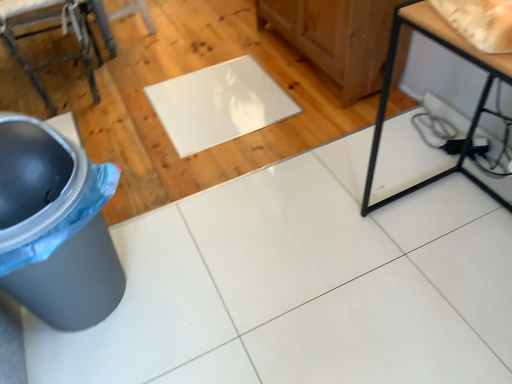
The width and height of the screenshot is (512, 384). I want to click on metallic gray stool at upper left, so click(63, 33).

Where is `glossy white mat at center`? The height and width of the screenshot is (384, 512). glossy white mat at center is located at coordinates (219, 104).

This screenshot has width=512, height=384. Find the location of `gray plastic trash can at lower left`. gray plastic trash can at lower left is located at coordinates (36, 178).

You are a GUI agent. You are given a task and a screenshot of the screen. Output one action in this format:
    pyautogui.click(x=<x>, y=<y>)
    Task: Click on the metallic gray stool at upper left
    The width and height of the screenshot is (512, 384).
    Given the screenshot: What is the action you would take?
    pyautogui.click(x=63, y=33)

Is black metal table at lower right smaller than glossy white mat at center?

No.

From the image's perspective, between black metal table at lower right and glossy white mat at center, who is located below?

From the image's view, black metal table at lower right is below.

Is black metal table at lower right surrounding glossy white mat at center?

Actually, glossy white mat at center is outside black metal table at lower right.

Does black metal table at lower right appear on the left side of glossy white mat at center?

Incorrect, black metal table at lower right is not on the left side of glossy white mat at center.

From a real-world perspective, between metallic gray stool at upper left and gray plastic trash can at lower left, who is vertically lower?

From a 3D spatial view, metallic gray stool at upper left is below.

Would you say metallic gray stool at upper left is a long distance from gray plastic trash can at lower left?

metallic gray stool at upper left is positioned a significant distance from gray plastic trash can at lower left.

Is metallic gray stool at upper left not inside gray plastic trash can at lower left?

Yes.

From the image's perspective, is gray plastic trash can at lower left located beneath black metal table at lower right?

Indeed, from the image's perspective, gray plastic trash can at lower left is shown beneath black metal table at lower right.

Is gray plastic trash can at lower left with black metal table at lower right?

gray plastic trash can at lower left and black metal table at lower right are clearly separated.

Does gray plastic trash can at lower left have a greater height compared to black metal table at lower right?

No.

From a real-world perspective, is black metal table at lower right located higher than metallic gray stool at upper left?

Yes, from a real-world perspective, black metal table at lower right is over metallic gray stool at upper left

Between black metal table at lower right and metallic gray stool at upper left, which one has more height?

black metal table at lower right is taller.

From the image's perspective, which one is positioned lower, black metal table at lower right or metallic gray stool at upper left?

black metal table at lower right is shown below in the image.

Who is smaller, black metal table at lower right or metallic gray stool at upper left?

With smaller size is metallic gray stool at upper left.

Is glossy white mat at center not close to metallic gray stool at upper left?

That's not correct — glossy white mat at center is a little close to metallic gray stool at upper left.

Looking at their sizes, would you say glossy white mat at center is wider or thinner than metallic gray stool at upper left?

Clearly, glossy white mat at center has more width compared to metallic gray stool at upper left.

From the image's perspective, between glossy white mat at center and metallic gray stool at upper left, who is located below?

From the image's view, glossy white mat at center is below.

Can you confirm if glossy white mat at center is bigger than metallic gray stool at upper left?

No, glossy white mat at center is not bigger than metallic gray stool at upper left.

Which of these two, metallic gray stool at upper left or black metal table at lower right, is bigger?

Bigger between the two is black metal table at lower right.

Is metallic gray stool at upper left completely or partially outside of black metal table at lower right?

That's correct, metallic gray stool at upper left is outside of black metal table at lower right.

Could you tell me if metallic gray stool at upper left is turned towards black metal table at lower right?

No, metallic gray stool at upper left is not facing towards black metal table at lower right.

Locate an element on the screen. The width and height of the screenshot is (512, 384). furniture lying on the left of black metal table at lower right is located at coordinates [63, 33].

Looking at this image, is glossy white mat at center wider than gray plastic trash can at lower left?

Indeed, glossy white mat at center has a greater width compared to gray plastic trash can at lower left.

Does point (230, 136) lie in front of point (50, 137)?

No, it is not.

Who is smaller, glossy white mat at center or gray plastic trash can at lower left?

With smaller size is glossy white mat at center.

This screenshot has height=384, width=512. In order to click on mat that is under the black metal table at lower right (from a real-world perspective) in this screenshot , I will do `click(219, 104)`.

The height and width of the screenshot is (384, 512). Identify the location of waste container that is above the metallic gray stool at upper left (from a real-world perspective). (36, 178).

Which object lies nearer to the anchor point black metal table at lower right, metallic gray stool at upper left or glossy white mat at center?

The object closer to black metal table at lower right is glossy white mat at center.

From the image, which object appears to be nearer to metallic gray stool at upper left, gray plastic trash can at lower left or glossy white mat at center?

glossy white mat at center is closer to metallic gray stool at upper left.

From the image, which object appears to be nearer to glossy white mat at center, metallic gray stool at upper left or gray plastic trash can at lower left?

metallic gray stool at upper left is positioned closer to the anchor glossy white mat at center.

When comparing their distances from black metal table at lower right, does glossy white mat at center or metallic gray stool at upper left seem closer?

Among the two, glossy white mat at center is located nearer to black metal table at lower right.

Which object lies further to the anchor point gray plastic trash can at lower left, black metal table at lower right or metallic gray stool at upper left?

metallic gray stool at upper left lies further to gray plastic trash can at lower left than the other object.

Estimate the real-world distances between objects in this image. Which object is further from black metal table at lower right, gray plastic trash can at lower left or glossy white mat at center?

Among the two, gray plastic trash can at lower left is located further to black metal table at lower right.

Looking at the image, which one is located closer to gray plastic trash can at lower left, glossy white mat at center or black metal table at lower right?

The object closer to gray plastic trash can at lower left is glossy white mat at center.

Looking at the image, which one is located closer to glossy white mat at center, gray plastic trash can at lower left or black metal table at lower right?

black metal table at lower right.

Locate an element on the screen. waste container between black metal table at lower right and glossy white mat at center along the z-axis is located at coordinates click(36, 178).

This screenshot has height=384, width=512. I want to click on waste container between metallic gray stool at upper left and black metal table at lower right from left to right, so click(36, 178).

Identify the location of furniture positioned between gray plastic trash can at lower left and glossy white mat at center from near to far. (63, 33).

Find the location of `mat located between metallic gray stool at upper left and black metal table at lower right in the left-right direction`. mat located between metallic gray stool at upper left and black metal table at lower right in the left-right direction is located at coordinates (219, 104).